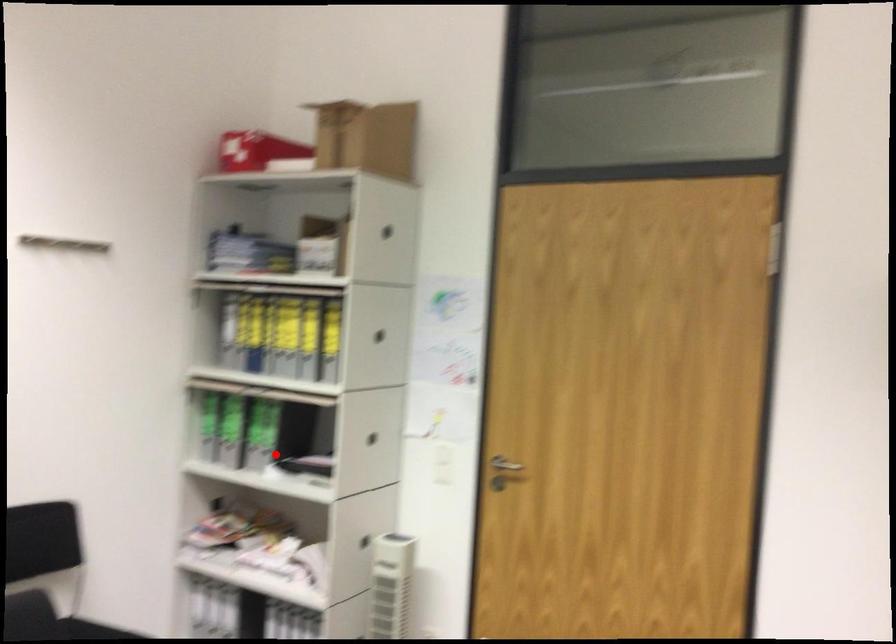
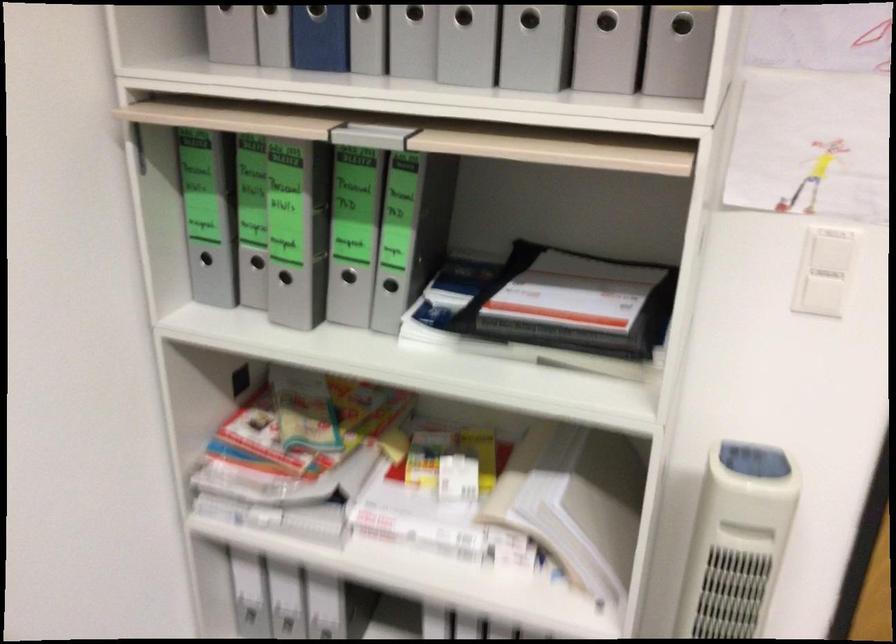
Find the pixel in the second image that matches the highlighted location in the first image.

(390, 285)